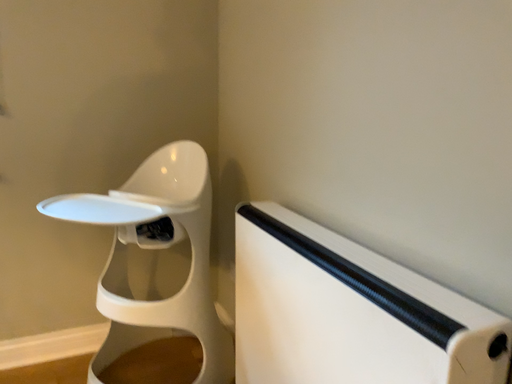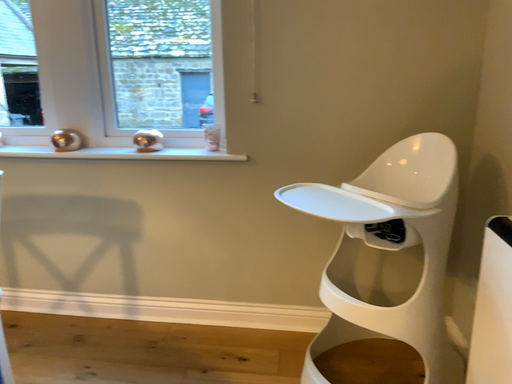
Question: How did the camera likely rotate when shooting the video?

Choices:
 (A) rotated right
 (B) rotated left

Answer: (B)